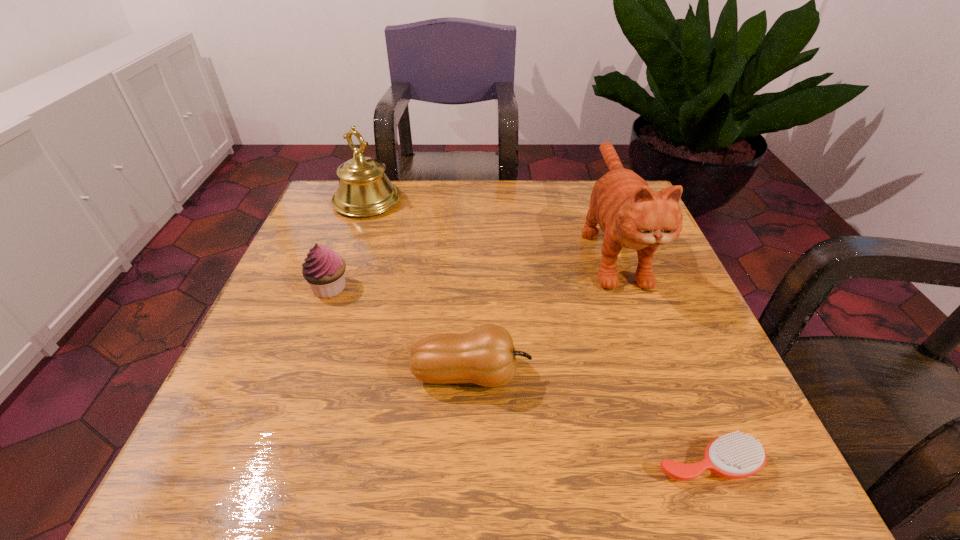
Select which object is the second closest to the cat. Please provide its 2D coordinates. Your answer should be formatted as a tuple, i.e. [(x, y)], where the tuple contains the x and y coordinates of a point satisfying the conditions above.

[(735, 455)]

At what (x,y) coordinates should I click in order to perform the action: click on blank area in the image that satisfies the following two spatial constraints: 1. on the face of the tallest object; 2. on the stem side of the gourd. Please return your answer as a coordinate pair (x, y). Looking at the image, I should click on (659, 375).

The height and width of the screenshot is (540, 960). I want to click on free space that satisfies the following two spatial constraints: 1. on the face of the tallest object; 2. on the stem side of the third object from right to left, so click(x=659, y=375).

I want to click on free location that satisfies the following two spatial constraints: 1. on the stem side of the third object from right to left; 2. on the right side of the shortest object, so click(469, 463).

Where is `vacant space that satisfies the following two spatial constraints: 1. on the stem side of the nearest object; 2. on the left side of the second nearest object`? Image resolution: width=960 pixels, height=540 pixels. vacant space that satisfies the following two spatial constraints: 1. on the stem side of the nearest object; 2. on the left side of the second nearest object is located at coordinates (469, 463).

Where is `free spot that satisfies the following two spatial constraints: 1. on the stem side of the gourd; 2. on the left side of the nearest object`? The image size is (960, 540). free spot that satisfies the following two spatial constraints: 1. on the stem side of the gourd; 2. on the left side of the nearest object is located at coordinates (469, 463).